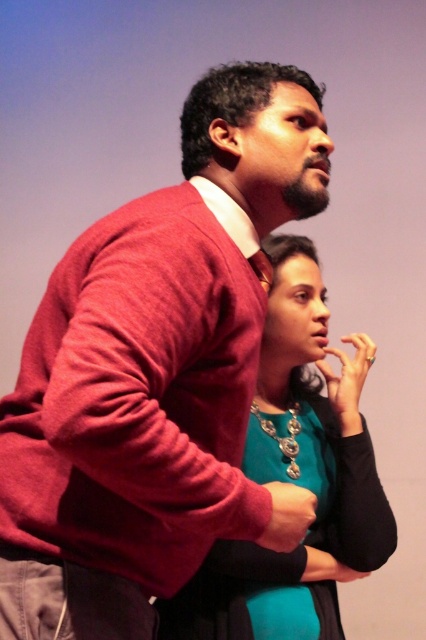
Question: Is the position of matte red sweater at upper left more distant than that of teal satin blouse at center?

Choices:
 (A) no
 (B) yes

Answer: (A)

Question: Does matte red sweater at upper left come in front of teal satin blouse at center?

Choices:
 (A) no
 (B) yes

Answer: (B)

Question: Which of the following is the farthest from the observer?

Choices:
 (A) (298, 572)
 (B) (238, 490)

Answer: (A)

Question: Which point is farther to the camera?

Choices:
 (A) (222, 584)
 (B) (78, 300)

Answer: (A)

Question: Observing the image, what is the correct spatial positioning of matte red sweater at upper left in reference to teal satin blouse at center?

Choices:
 (A) left
 (B) right

Answer: (A)